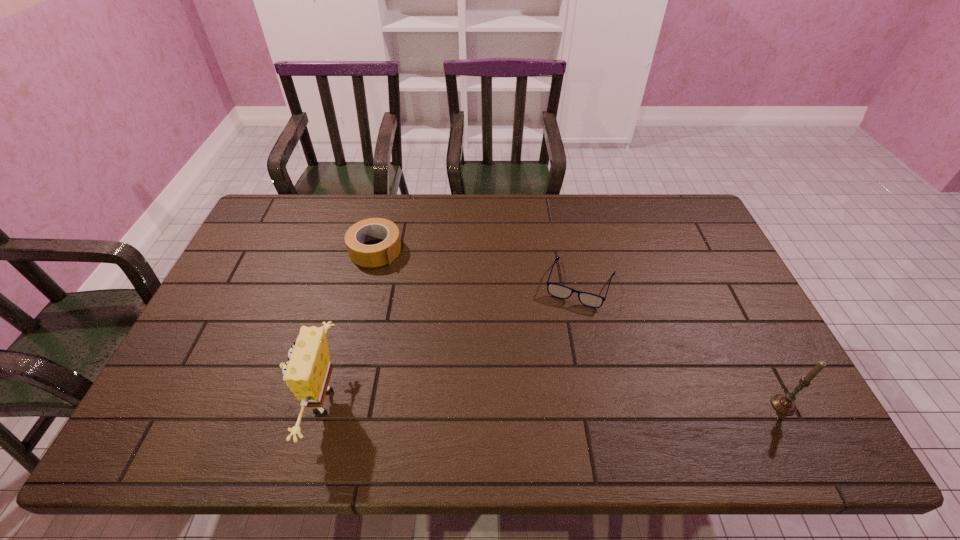
Identify the location of object at the near right corner. (784, 404).

You are a GUI agent. You are given a task and a screenshot of the screen. Output one action in this format:
    pyautogui.click(x=<x>, y=<y>)
    Task: Click on the free space at the far edge of the desktop
    
    Given the screenshot: What is the action you would take?
    pyautogui.click(x=342, y=196)

Find the location of a particular element. vacant space at the near edge of the desktop is located at coordinates (369, 385).

In the image, there is a desktop. Identify the location of vacant space at the left edge. (242, 359).

At what (x,y) coordinates should I click in order to perform the action: click on free space at the right edge. Please return your answer as a coordinate pair (x, y). Image resolution: width=960 pixels, height=540 pixels. Looking at the image, I should click on (696, 310).

This screenshot has width=960, height=540. What are the coordinates of `free space at the far left corner of the desktop` in the screenshot? It's located at [285, 213].

Locate an element on the screen. The height and width of the screenshot is (540, 960). free space at the near right corner of the desktop is located at coordinates click(x=750, y=405).

You are a GUI agent. You are given a task and a screenshot of the screen. Output one action in this format:
    pyautogui.click(x=<x>, y=<y>)
    Task: Click on the free space between the duct tape and the tallest object
    The image size is (960, 540).
    Given the screenshot: What is the action you would take?
    pyautogui.click(x=348, y=326)

Locate an element on the screen. free spot between the shortest object and the rightmost object is located at coordinates (682, 345).

This screenshot has height=540, width=960. I want to click on vacant space that is in between the sponge and the candle, so click(552, 404).